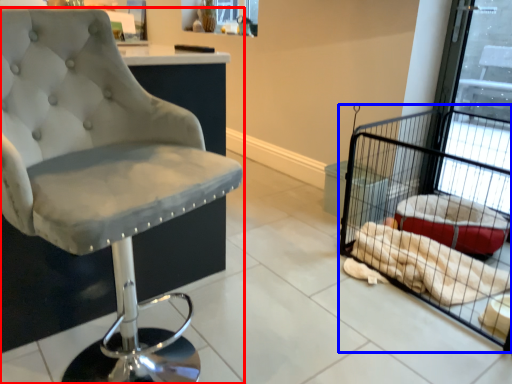
Question: Among these objects, which one is nearest to the camera, chair (highlighted by a red box) or bird cage (highlighted by a blue box)?

Choices:
 (A) chair
 (B) bird cage

Answer: (A)